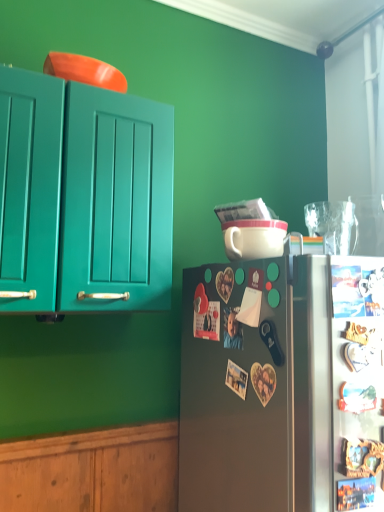
The height and width of the screenshot is (512, 384). What do you see at coordinates (83, 197) in the screenshot? I see `teal glossy cabinet doors at upper left` at bounding box center [83, 197].

This screenshot has height=512, width=384. Find the location of `teal glossy cabinet doors at upper left`. teal glossy cabinet doors at upper left is located at coordinates (83, 197).

You are a GUI agent. You are given a task and a screenshot of the screen. Output one action in this format:
    pyautogui.click(x=<x>, y=<y>)
    Task: Click on the teal glossy cabinet doors at upper left
    
    Given the screenshot: What is the action you would take?
    pyautogui.click(x=83, y=197)